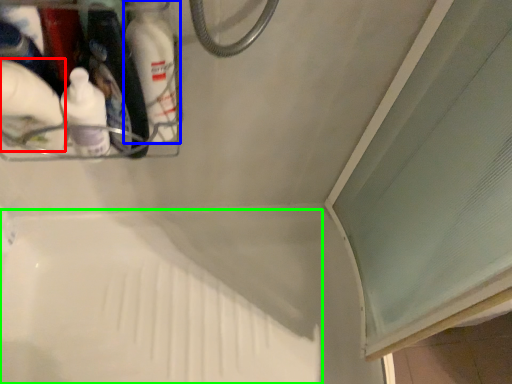
Question: Estimate the real-world distances between objects in this image. Which object is farther from cleaning product (highlighted by a red box), bottle (highlighted by a blue box) or bath (highlighted by a green box)?

Choices:
 (A) bottle
 (B) bath

Answer: (B)